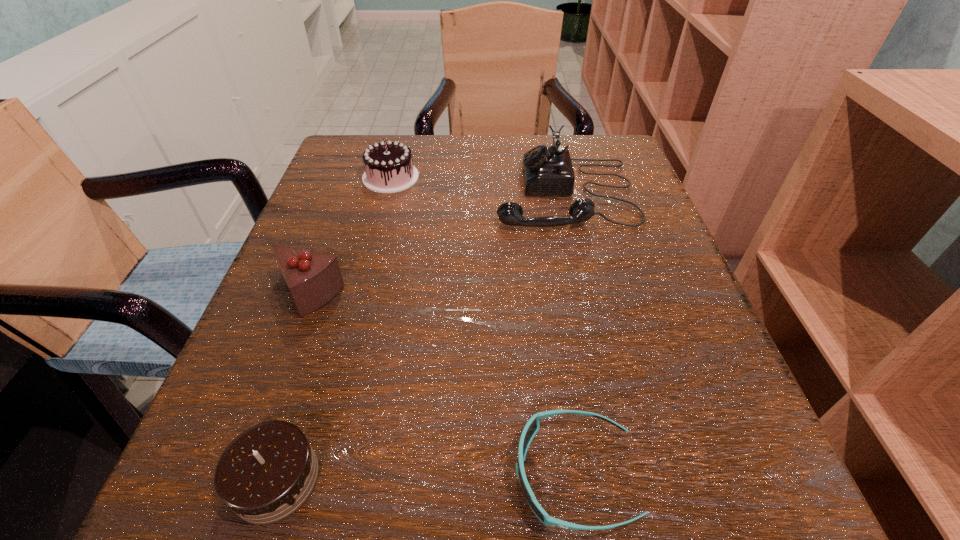
Find the location of `object that is at the far left corner`. object that is at the far left corner is located at coordinates (389, 168).

Where is `object at the near left corner`? Image resolution: width=960 pixels, height=540 pixels. object at the near left corner is located at coordinates (269, 471).

Locate an element on the screen. The height and width of the screenshot is (540, 960). object positioned at the far right corner is located at coordinates (546, 170).

Image resolution: width=960 pixels, height=540 pixels. Identify the location of object at the near right corner. (532, 426).

Identify the location of vacant area at the far edge of the desktop. (429, 143).

Image resolution: width=960 pixels, height=540 pixels. I want to click on blank space at the near edge of the desktop, so click(595, 463).

At what (x,y) coordinates should I click in order to perform the action: click on free space at the left edge. Please return your answer as a coordinate pair (x, y). Looking at the image, I should click on (258, 314).

Image resolution: width=960 pixels, height=540 pixels. In the image, there is a desktop. In order to click on vacant region at the right edge in this screenshot , I will do `click(642, 372)`.

The width and height of the screenshot is (960, 540). In order to click on free space at the far right corner of the desktop in this screenshot , I will do `click(588, 176)`.

Image resolution: width=960 pixels, height=540 pixels. In the image, there is a desktop. Find the location of `vacant area at the near right corner`. vacant area at the near right corner is located at coordinates (684, 484).